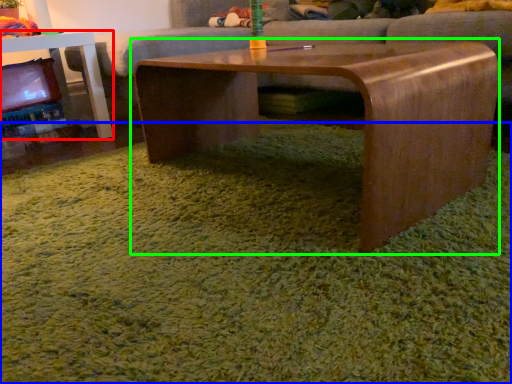
Question: Considering the real-world distances, which object is closest to table (highlighted by a red box)? grass (highlighted by a blue box) or coffee table (highlighted by a green box).

Choices:
 (A) grass
 (B) coffee table

Answer: (B)